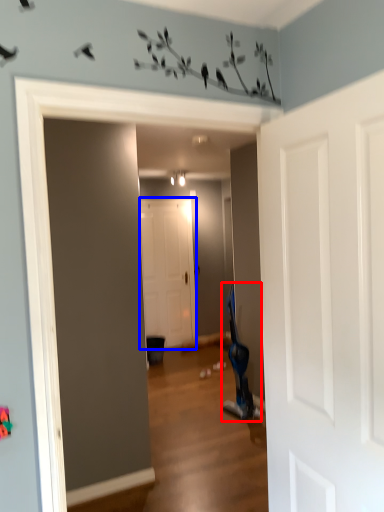
Question: Which object appears closest to the camera in this image, swivel chair (highlighted by a red box) or door (highlighted by a blue box)?

Choices:
 (A) swivel chair
 (B) door

Answer: (A)